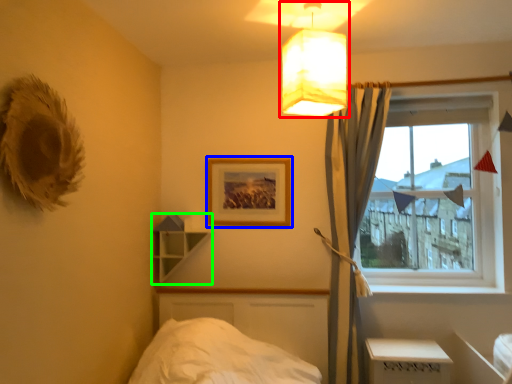
Question: Which object is positioned closest to lamp (highlighted by a red box)? Select from picture frame (highlighted by a blue box) and shelf (highlighted by a green box).

Choices:
 (A) picture frame
 (B) shelf

Answer: (A)